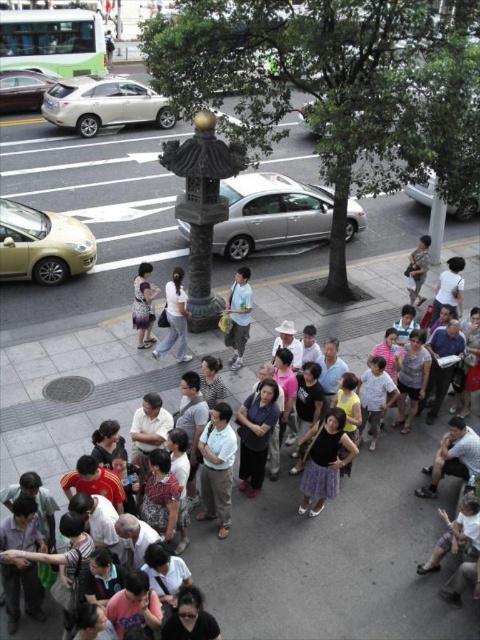
Question: Considering the relative positions of light blue jeans at center and matte black dress at center in the image provided, where is light blue jeans at center located with respect to matte black dress at center?

Choices:
 (A) above
 (B) below

Answer: (B)

Question: Is light blue jeans at center above khaki cotton pants at center?

Choices:
 (A) no
 (B) yes

Answer: (A)

Question: Which of these objects is positioned farthest from the khaki cotton pants at center?

Choices:
 (A) gray concrete pavement at lower center
 (B) matte black dress at center
 (C) light blue jeans at center
 (D) light blue fabric shirt at center

Answer: (D)

Question: Which point is farther from the camera taking this photo?

Choices:
 (A) (216, 483)
 (B) (169, 339)
 (C) (144, 282)
 (D) (307, 531)

Answer: (B)

Question: Which point is farther from the camera taking this photo?

Choices:
 (A) (352, 444)
 (B) (139, 300)
 (C) (369, 560)

Answer: (B)

Question: Can you confirm if light blue shirt at center is wider than matte black dress at center?

Choices:
 (A) no
 (B) yes

Answer: (A)